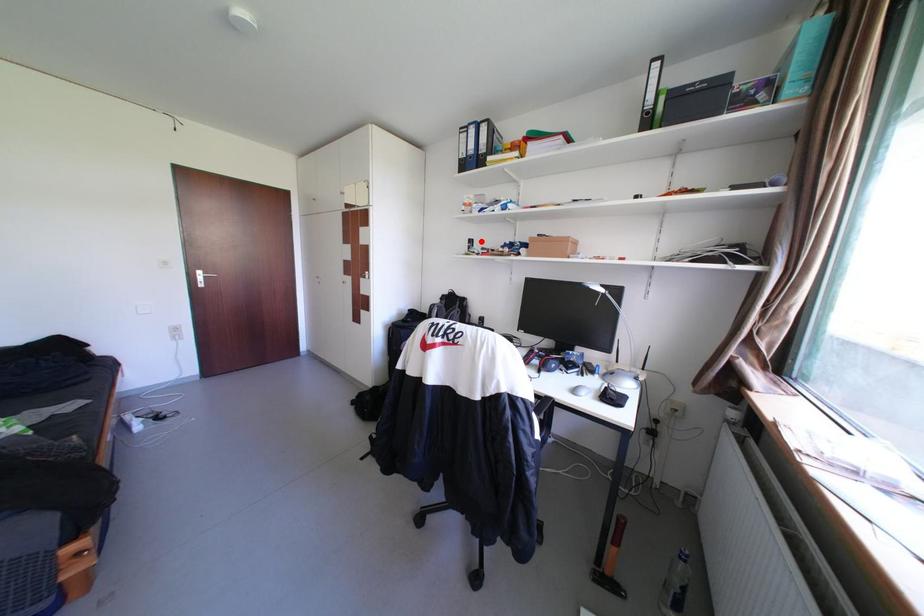
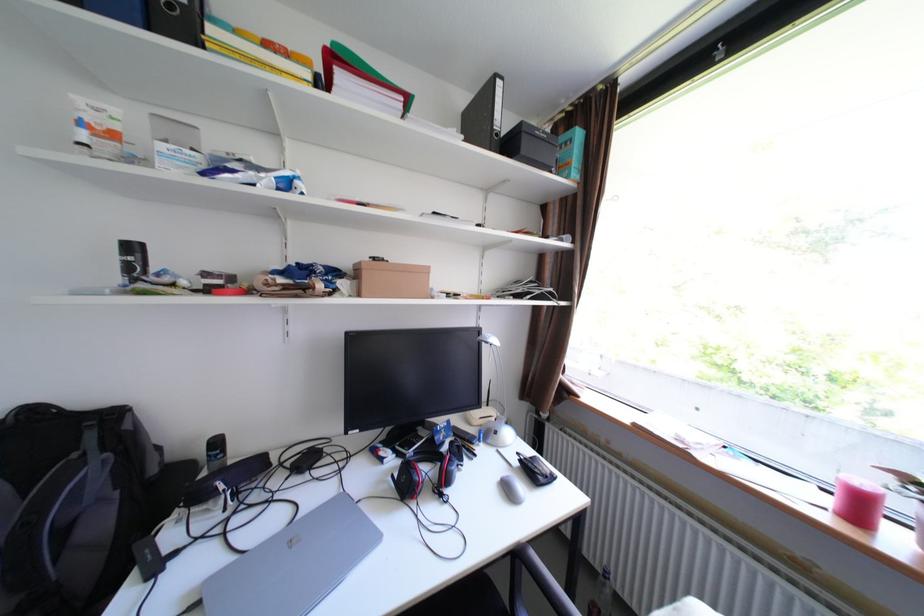
Locate, in the second image, the point that corresponds to the highlighted location in the first image.

(143, 248)